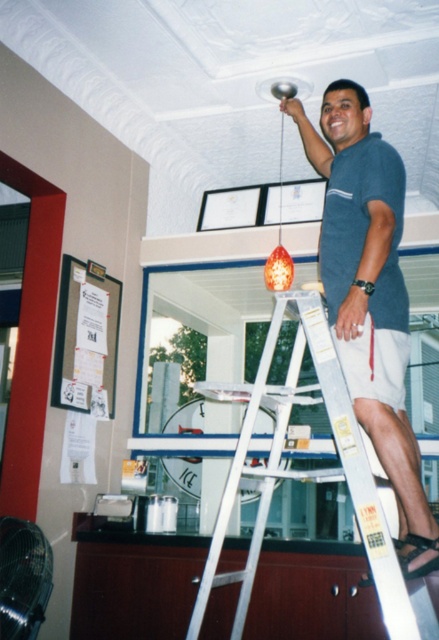
You are an electrician working on a ladder in an office. You need to reach both the blue cotton shirt at upper center and the orange glass pendant at upper center. Which one is closer to you?

The blue cotton shirt at upper center and orange glass pendant at upper center are 1.05 meters apart, but the description does not specify which one is closer. Therefore, I cannot determine which one is closer based on the given information.

You are an interior designer assessing the space. You need to ensure that the blue cotton shirt at upper center and the white metallic ladder at center are positioned safely. Considering their widths, which object might require more caution to avoid blocking pathways?

The blue cotton shirt at upper center has a lesser width compared to the white metallic ladder at center, so the ladder is wider and might require more caution to avoid blocking pathways.